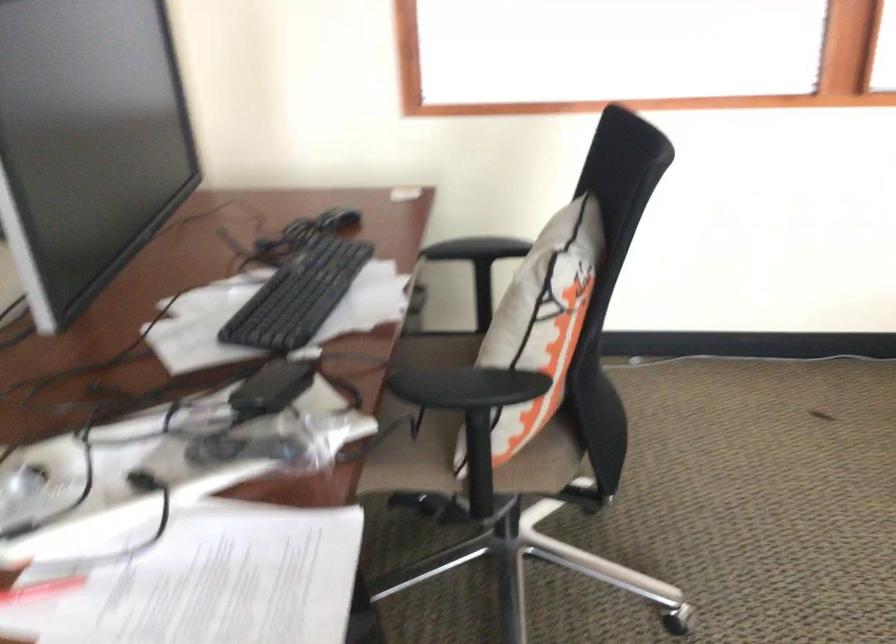
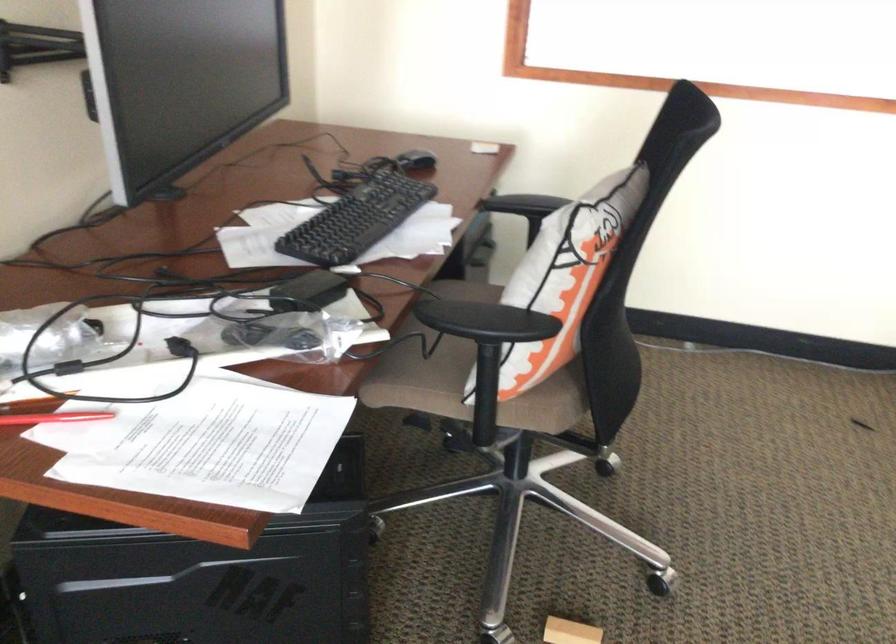
Locate, in the second image, the point that corresponds to [464,249] in the first image.

(522, 204)